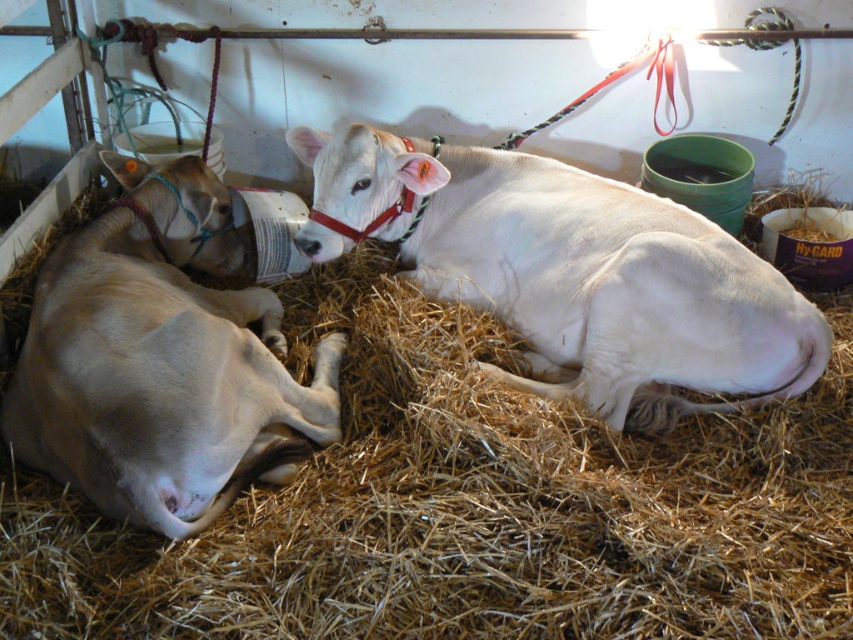
You are standing at the entrance of the barn and see the two cows. There is a point marked at coordinates (467,508). What is located at that point?

The point at coordinates (467,508) corresponds to brown straw at center.

You are standing in the barn and want to place a new hay bale exactly where the brown straw at center is located. What are the coordinates for placing the hay bale?

The coordinates for placing the hay bale are at point [467,508].

You are a farmer who wants to know which cow is bigger between the white smooth cow at center and the light brown smooth cow at left. Can you tell me which one is bigger?

The white smooth cow at center is larger in size than the light brown smooth cow at left.